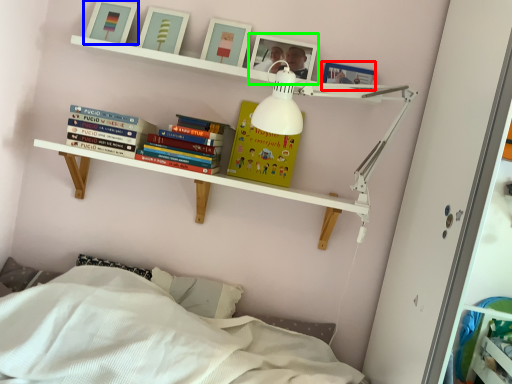
Question: Based on their relative distances, which object is farther from picture frame (highlighted by a red box)? Choose from picture frame (highlighted by a blue box) and picture frame (highlighted by a green box).

Choices:
 (A) picture frame
 (B) picture frame

Answer: (A)